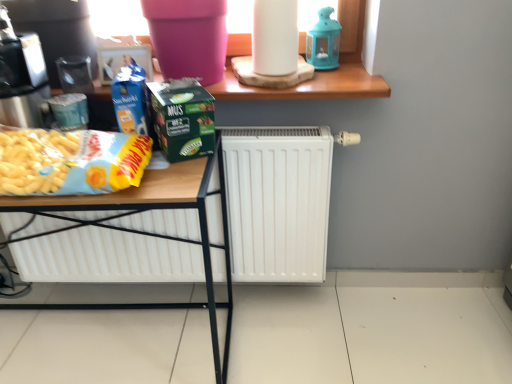
What are the coordinates of `vacant space underneath green matte carton at center (from a real-world perspective)` in the screenshot? It's located at (184, 158).